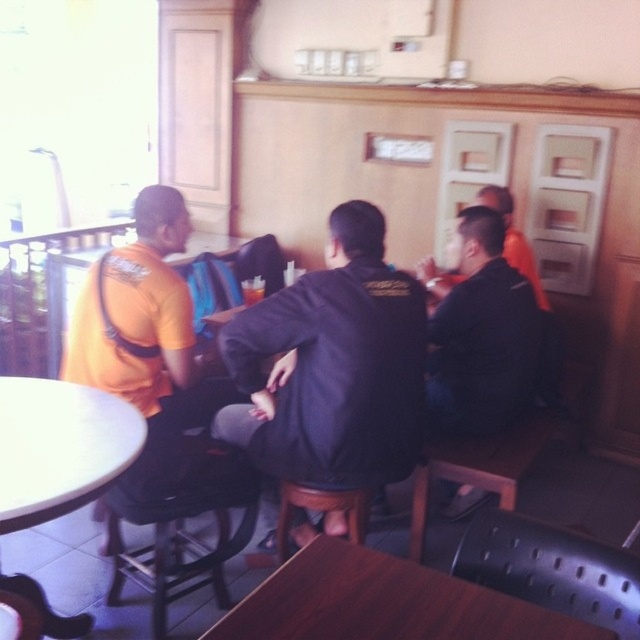
You are a waiter in a busy restaurant and need to deliver a tray of drinks to the wooden table at center without walking behind the white glossy round table at lower left. Is this possible based on their positions?

The wooden table at center is in front of the white glossy round table at lower left, so you can approach the wooden table at center directly without needing to go behind the white glossy round table at lower left. Therefore, it is possible to deliver the drinks without walking behind the white glossy round table at lower left.

You are a photographer trying to capture a clear shot of both the orange matte shirt at left and the black matte jacket at upper right in the scene. Since the image is slightly blurred, which object should you focus on first to ensure clarity?

The orange matte shirt at left should be focused on first because it is closer to the viewer than the black matte jacket at upper right, ensuring clarity before adjusting focus for the farther object.